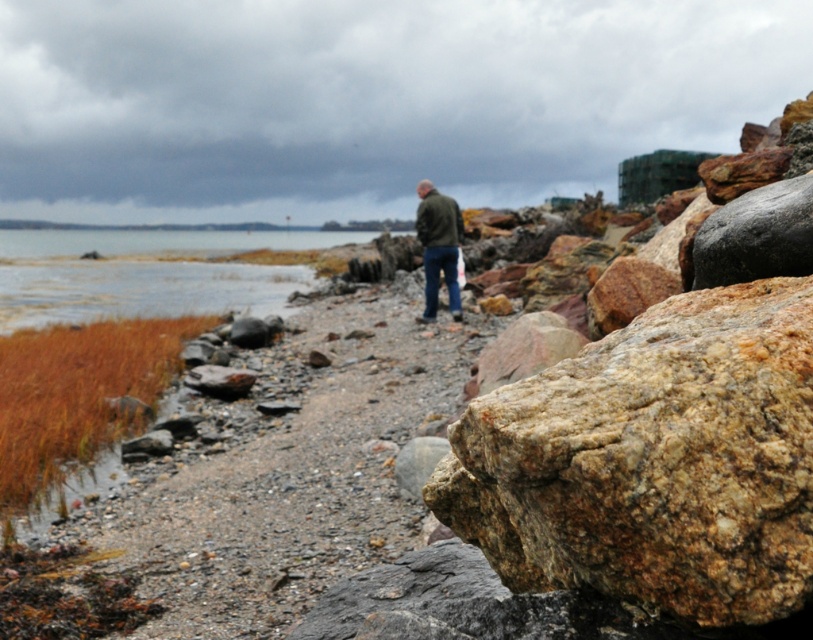
You are standing on the gravel path and see the clear water at lower left and the green matte jacket at center. Which object is higher in the image?

The clear water at lower left is above the green matte jacket at center, so the clear water at lower left is higher in the image.

You are standing on the clear water at lower left and want to walk to the dull gray gravel at center. Which direction should you move to reach it?

The dull gray gravel at center is to the right of clear water at lower left, so you should move to your right to reach it.

You are standing on the dull gray gravel at center and want to see the top of the green matte jacket at center. Can you see it without moving?

The dull gray gravel at center is not as tall as the green matte jacket at center, so yes, you can see the top of the green matte jacket at center from your position on the dull gray gravel at center.